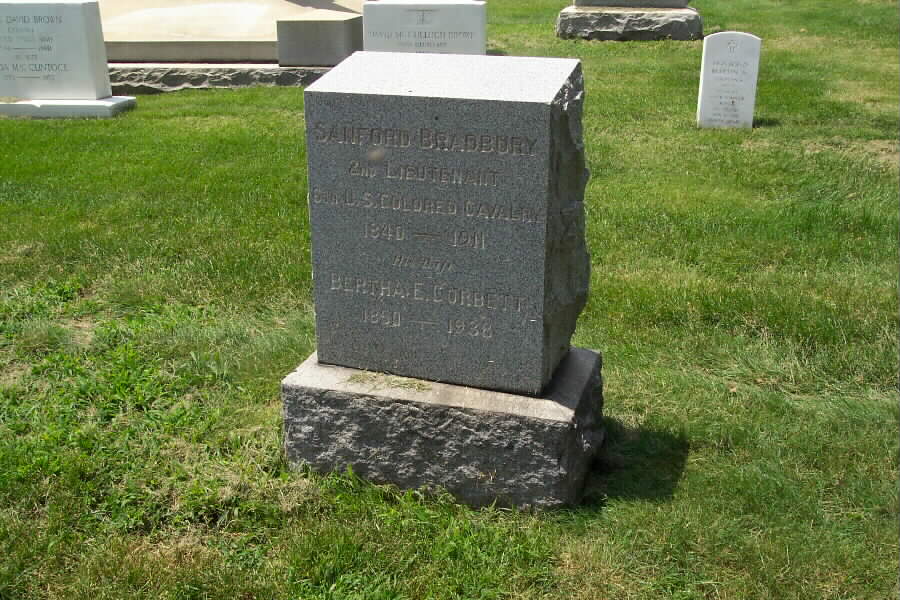
You are a GUI agent. You are given a task and a screenshot of the screen. Output one action in this format:
    pyautogui.click(x=<x>, y=<y>)
    Task: Click on the dead plant
    
    Given the screenshot: What is the action you would take?
    pyautogui.click(x=374, y=381)